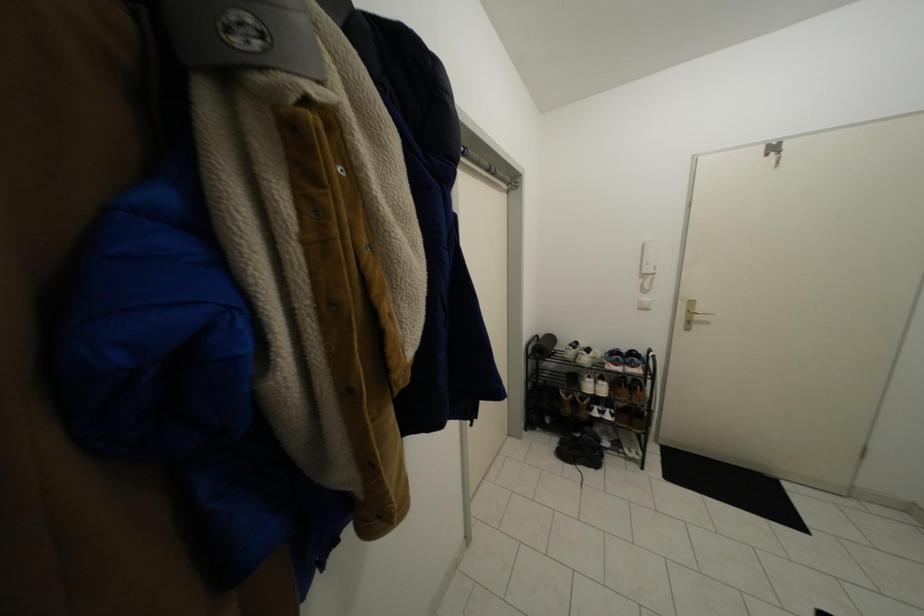
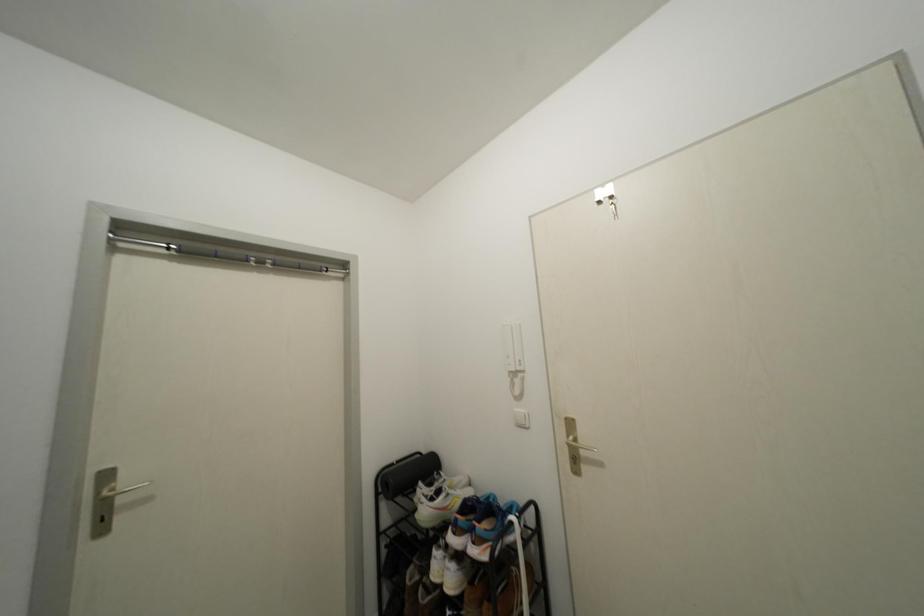
In a continuous first-person perspective shot, in which direction is the camera moving?

The movement direction of the cameraman is right, forward.